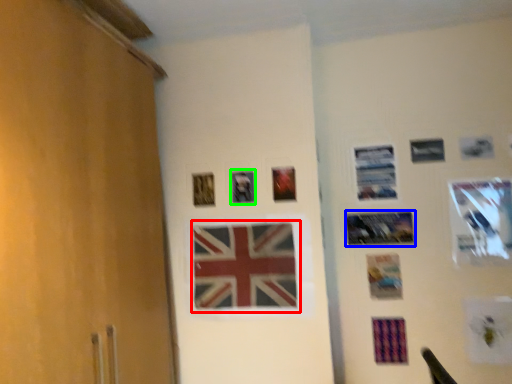
Question: Considering the real-world distances, which object is closest to flag (highlighted by a red box)? picture frame (highlighted by a blue box) or picture frame (highlighted by a green box).

Choices:
 (A) picture frame
 (B) picture frame

Answer: (B)